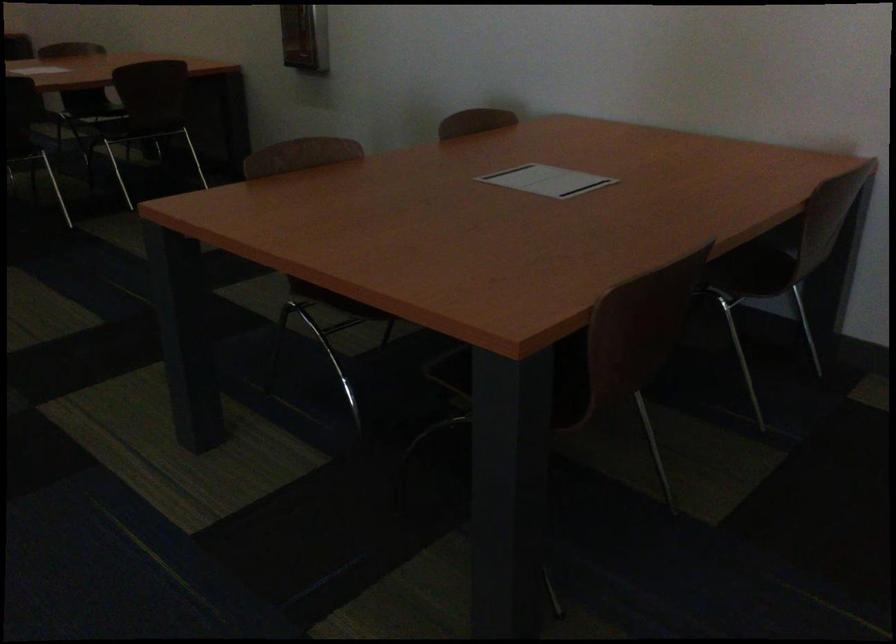
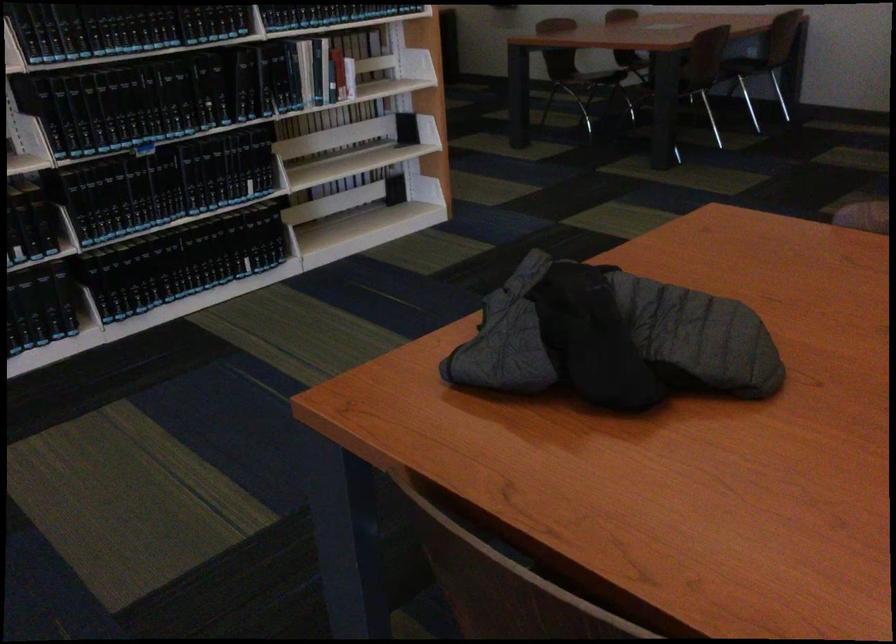
Question: In a continuous first-person perspective shot, in which direction is the camera moving?

Choices:
 (A) Left
 (B) Right
 (C) Forward
 (D) Backward

Answer: (D)